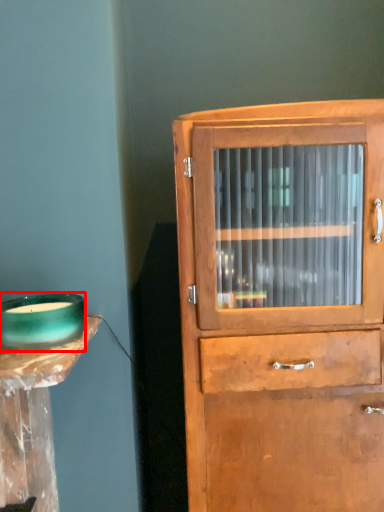
Question: From the image's perspective, where is candle holder (annotated by the red box) located in relation to cupboard in the image?

Choices:
 (A) above
 (B) below

Answer: (A)